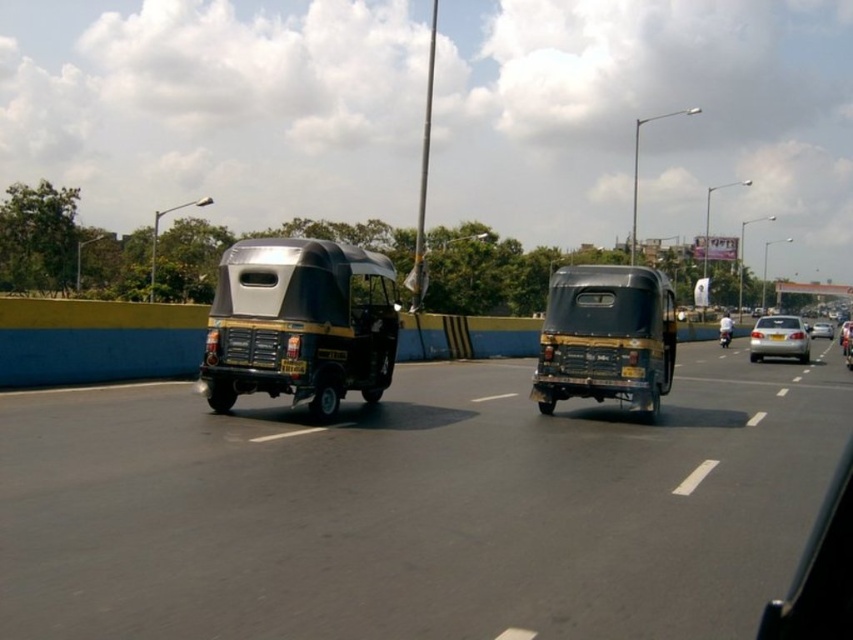
Does metallic tuk-tuk at center have a greater height compared to metallic silver auto-rickshaw at center?

In fact, metallic tuk-tuk at center may be shorter than metallic silver auto-rickshaw at center.

Can you confirm if metallic tuk-tuk at center is smaller than metallic silver auto-rickshaw at center?

Correct, metallic tuk-tuk at center occupies less space than metallic silver auto-rickshaw at center.

Between point (184, 554) and point (724, 324), which one is positioned behind?

Positioned behind is point (724, 324).

I want to click on metallic tuk-tuk at center, so click(416, 508).

From the picture: Does matte black auto-rickshaw at center have a lesser height compared to metallic silver auto-rickshaw at center?

Correct, matte black auto-rickshaw at center is not as tall as metallic silver auto-rickshaw at center.

Where is `matte black auto-rickshaw at center`? matte black auto-rickshaw at center is located at coordinates (606, 337).

Does black matte auto-rickshaw at center appear on the left side of metallic silver auto-rickshaw at center?

Indeed, black matte auto-rickshaw at center is positioned on the left side of metallic silver auto-rickshaw at center.

Who is more forward, (254,237) or (726,330)?

Point (254,237) is more forward.

Is point (305, 289) positioned behind point (726, 312)?

No, it is in front of (726, 312).

Find the location of a particular element. This screenshot has height=640, width=853. black matte auto-rickshaw at center is located at coordinates (300, 323).